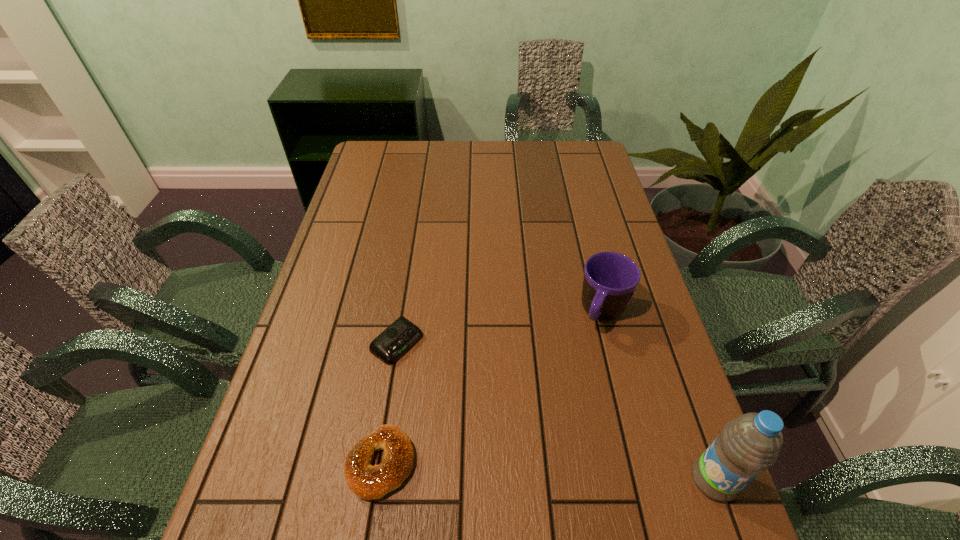
At what (x,y) coordinates should I click in order to perform the action: click on vacant area at the left edge of the desktop. Please return your answer as a coordinate pair (x, y). Looking at the image, I should click on (335, 228).

This screenshot has width=960, height=540. I want to click on vacant position at the right edge of the desktop, so click(x=675, y=417).

Where is `vacant space at the far left corner of the desktop`? vacant space at the far left corner of the desktop is located at coordinates (390, 146).

At what (x,y) coordinates should I click in order to perform the action: click on free space between the bagel and the mug. Please return your answer as a coordinate pair (x, y). The width and height of the screenshot is (960, 540). Looking at the image, I should click on (492, 388).

Find the location of a particular element. The image size is (960, 540). unoccupied position between the tallest object and the mug is located at coordinates (659, 396).

The height and width of the screenshot is (540, 960). I want to click on free point between the bagel and the shortest object, so click(x=389, y=403).

You are a GUI agent. You are given a task and a screenshot of the screen. Output one action in this format:
    pyautogui.click(x=<x>, y=<y>)
    Task: Click on the free space between the water bottle and the mug
    Image resolution: width=960 pixels, height=540 pixels.
    Given the screenshot: What is the action you would take?
    pyautogui.click(x=659, y=396)

Image resolution: width=960 pixels, height=540 pixels. In order to click on unoccupied area between the shortest object and the rightmost object in this screenshot , I will do `click(555, 411)`.

Locate an element on the screen. unoccupied area between the shortest object and the mug is located at coordinates (500, 328).

You are a GUI agent. You are given a task and a screenshot of the screen. Output one action in this format:
    pyautogui.click(x=<x>, y=<y>)
    Task: Click on the free point between the second shortest object and the water bottle
    This screenshot has width=960, height=540.
    Given the screenshot: What is the action you would take?
    pyautogui.click(x=547, y=471)